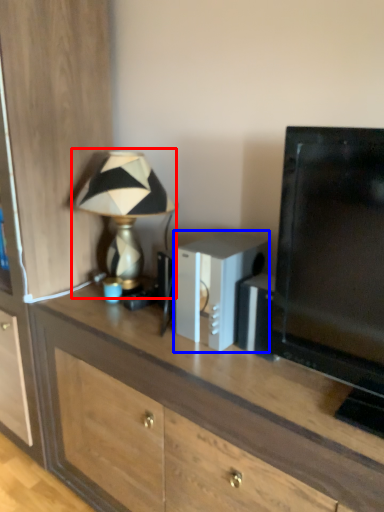
Question: Which object is further to the camera taking this photo, lamp (highlighted by a red box) or appliance (highlighted by a blue box)?

Choices:
 (A) lamp
 (B) appliance

Answer: (A)